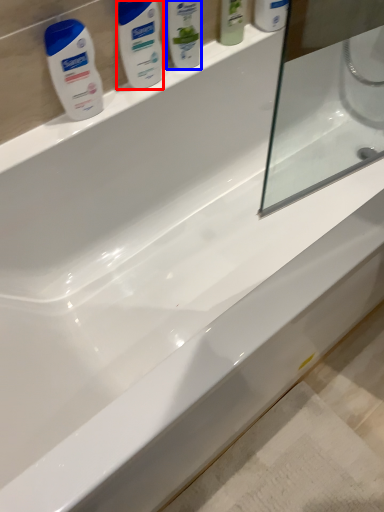
Question: Which object appears farthest to the camera in this image, personal care (highlighted by a red box) or cleaning product (highlighted by a blue box)?

Choices:
 (A) personal care
 (B) cleaning product

Answer: (B)